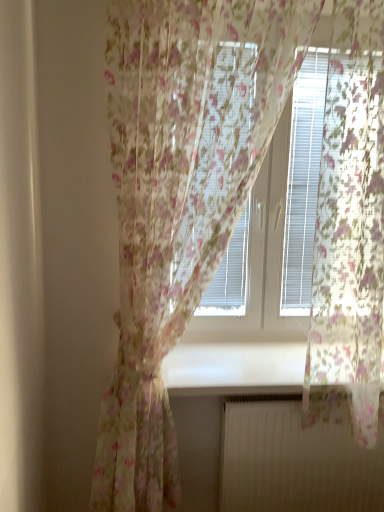
Question: Is white matte radiator at lower center positioned beyond the bounds of white glossy window sill at center?

Choices:
 (A) no
 (B) yes

Answer: (B)

Question: Is white matte radiator at lower center positioned in front of white glossy window sill at center?

Choices:
 (A) no
 (B) yes

Answer: (A)

Question: Is white matte radiator at lower center at the left side of white glossy window sill at center?

Choices:
 (A) no
 (B) yes

Answer: (A)

Question: Does white matte radiator at lower center turn towards white glossy window sill at center?

Choices:
 (A) yes
 (B) no

Answer: (B)

Question: Can white glossy window sill at center be found inside white matte radiator at lower center?

Choices:
 (A) yes
 (B) no

Answer: (B)

Question: Considering the positions of white matte radiator at lower center and white glossy window sill at center in the image, is white matte radiator at lower center bigger or smaller than white glossy window sill at center?

Choices:
 (A) small
 (B) big

Answer: (A)

Question: From the image's perspective, is white matte radiator at lower center above or below white glossy window sill at center?

Choices:
 (A) below
 (B) above

Answer: (A)

Question: From a real-world perspective, is white matte radiator at lower center positioned above or below white glossy window sill at center?

Choices:
 (A) below
 (B) above

Answer: (A)

Question: Which is correct: white matte radiator at lower center is inside white glossy window sill at center, or outside of it?

Choices:
 (A) outside
 (B) inside

Answer: (A)

Question: In the image, is white matte radiator at lower center positioned in front of or behind white plastic blinds at upper center?

Choices:
 (A) front
 (B) behind

Answer: (B)

Question: Is point (276, 463) closer or farther from the camera than point (296, 280)?

Choices:
 (A) farther
 (B) closer

Answer: (B)

Question: In terms of size, does white matte radiator at lower center appear bigger or smaller than white plastic blinds at upper center?

Choices:
 (A) small
 (B) big

Answer: (A)

Question: Visually, is white matte radiator at lower center positioned to the left or to the right of white plastic blinds at upper center?

Choices:
 (A) left
 (B) right

Answer: (A)

Question: In the image, is white glossy window sill at center on the left side or the right side of white matte radiator at lower center?

Choices:
 (A) left
 (B) right

Answer: (A)

Question: In terms of width, does white glossy window sill at center look wider or thinner when compared to white matte radiator at lower center?

Choices:
 (A) wide
 (B) thin

Answer: (A)